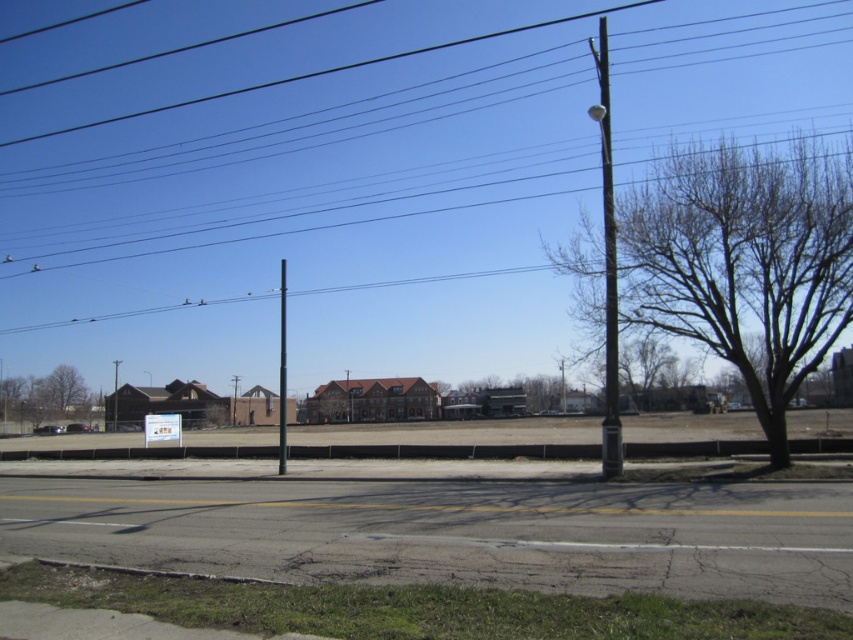
Question: Considering the relative positions of bare brown tree at center and white plastic sign at center in the image provided, where is bare brown tree at center located with respect to white plastic sign at center?

Choices:
 (A) left
 (B) right

Answer: (B)

Question: Where is brown leafless tree at left located in relation to white plastic sign at center in the image?

Choices:
 (A) above
 (B) below

Answer: (A)

Question: Considering the real-world distances, which object is closest to the black wire at upper center?

Choices:
 (A) white plastic sign at center
 (B) bare wood tree at right
 (C) bare brown tree at center
 (D) black metal pole at center

Answer: (B)

Question: Is smooth black pole at right bigger than bare brown tree at center?

Choices:
 (A) yes
 (B) no

Answer: (A)

Question: Which of the following is the closest to the observer?

Choices:
 (A) (283, 452)
 (B) (604, 260)
 (C) (6, 410)
 (D) (767, 392)

Answer: (D)

Question: Which point is closer to the camera?

Choices:
 (A) white plastic sign at center
 (B) brown leafless tree at left
 (C) smooth black pole at right
 (D) bare wood tree at right

Answer: (D)